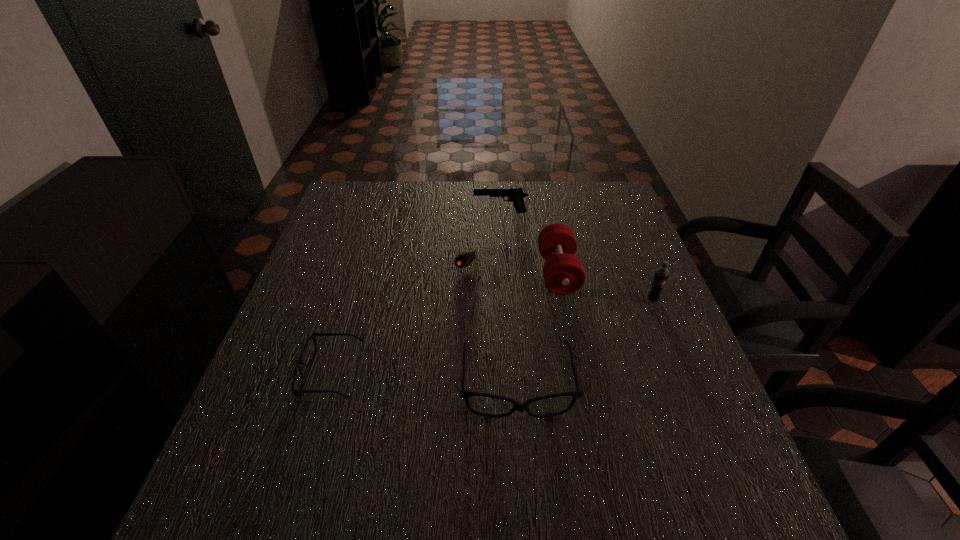
The width and height of the screenshot is (960, 540). What are the coordinates of `vacant space positioned 0.050m on the front-facing side of the right spectacles` in the screenshot? It's located at (522, 451).

Locate an element on the screen. Image resolution: width=960 pixels, height=540 pixels. free space located 0.060m at the aiming end of the farthest object is located at coordinates (454, 213).

Where is `vacant region located at the aiming end of the farthest object`? vacant region located at the aiming end of the farthest object is located at coordinates (386, 213).

At what (x,y) coordinates should I click in order to perform the action: click on free space located 0.120m at the aiming end of the farthest object. Please return your answer as a coordinate pair (x, y). The height and width of the screenshot is (540, 960). Looking at the image, I should click on (435, 213).

I want to click on free location located on the left of the shortest object, so click(x=318, y=259).

Locate an element on the screen. The height and width of the screenshot is (540, 960). vacant space positioned on the front label of the soda is located at coordinates (669, 340).

Where is `vacant space located on the left of the dumbbell`? Image resolution: width=960 pixels, height=540 pixels. vacant space located on the left of the dumbbell is located at coordinates (432, 273).

The height and width of the screenshot is (540, 960). What are the coordinates of `object at the far edge` in the screenshot? It's located at (515, 195).

Find the location of a particular element. object that is at the near edge is located at coordinates coord(465,395).

Identify the location of object situated at the left edge. The width and height of the screenshot is (960, 540). (314, 334).